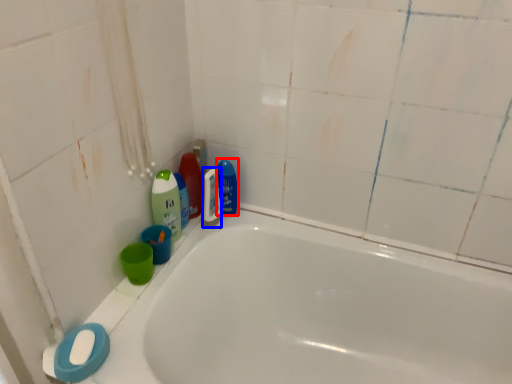
Question: Which of the following is the closest to the observer, cleaning product (highlighted by a red box) or mouthwash (highlighted by a blue box)?

Choices:
 (A) cleaning product
 (B) mouthwash

Answer: (B)